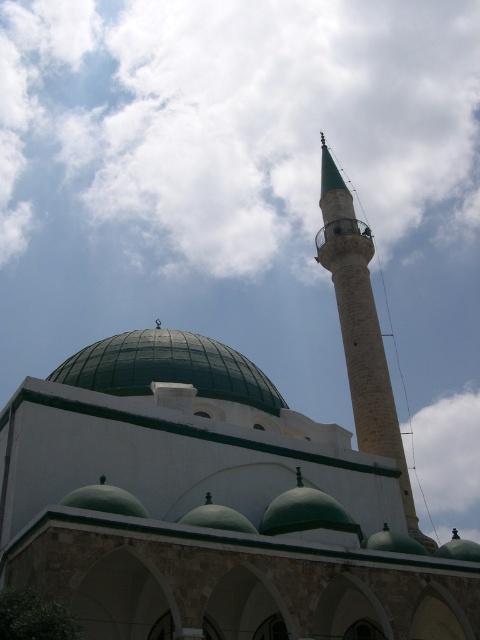
You are standing in front of the mosque and want to take a photo that includes both the green stone minaret at upper right and the green matte dome at center. Which object should appear closer to you in the photo?

The green stone minaret at upper right should appear closer to you in the photo because the green matte dome at center is behind it.

You are standing in front of the mosque and want to take a photo of the cloudy sky at upper center. According to the coordinates given, where exactly should you aim your camera?

You should aim your camera at point 0.183 on the horizontal axis and 0.504 on the vertical axis to capture the cloudy sky at upper center.

You are an architect designing a new mosque and want to ensure the cloudy sky at upper center and green matte dome at center are proportionally accurate in your blueprint. Which of these two elements should be drawn larger?

The cloudy sky at upper center should be drawn larger than the green matte dome at center as it is described as bigger.